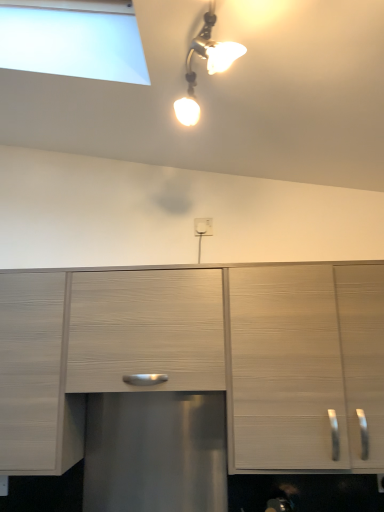
Question: Is white plastic electric outlet at center outside of light wood cabinet at right, the second cabinetry when ordered from left to right?

Choices:
 (A) yes
 (B) no

Answer: (A)

Question: Can you confirm if white plastic electric outlet at center is smaller than light wood cabinet at right, the second cabinetry when ordered from left to right?

Choices:
 (A) no
 (B) yes

Answer: (B)

Question: Is white plastic electric outlet at center positioned with its back to light wood cabinet at right, the first cabinetry when ordered from right to left?

Choices:
 (A) no
 (B) yes

Answer: (A)

Question: Does white plastic electric outlet at center have a lesser height compared to light wood cabinet at right, the second cabinetry when ordered from left to right?

Choices:
 (A) no
 (B) yes

Answer: (B)

Question: Is white plastic electric outlet at center to the left of light wood cabinet at right, the first cabinetry when ordered from right to left, from the viewer's perspective?

Choices:
 (A) no
 (B) yes

Answer: (B)

Question: Considering their positions, is light wood drawer at center located in front of or behind matte wood cabinet at left, which is counted as the second cabinetry, starting from the right?

Choices:
 (A) front
 (B) behind

Answer: (B)

Question: Does point (221, 388) appear closer or farther from the camera than point (36, 437)?

Choices:
 (A) farther
 (B) closer

Answer: (A)

Question: Based on their positions, is light wood drawer at center located to the left or right of matte wood cabinet at left, which is counted as the second cabinetry, starting from the right?

Choices:
 (A) right
 (B) left

Answer: (A)

Question: From the image's perspective, is light wood drawer at center positioned above or below matte wood cabinet at left, which is counted as the second cabinetry, starting from the right?

Choices:
 (A) above
 (B) below

Answer: (A)

Question: From a real-world perspective, is white plastic electric outlet at center physically located above or below light wood drawer at center?

Choices:
 (A) above
 (B) below

Answer: (A)

Question: Is white plastic electric outlet at center bigger or smaller than light wood drawer at center?

Choices:
 (A) big
 (B) small

Answer: (B)

Question: From their relative heights in the image, would you say white plastic electric outlet at center is taller or shorter than light wood drawer at center?

Choices:
 (A) tall
 (B) short

Answer: (B)

Question: From the image's perspective, relative to light wood drawer at center, is white plastic electric outlet at center above or below?

Choices:
 (A) below
 (B) above

Answer: (B)

Question: From a real-world perspective, is white plastic electric outlet at center positioned above or below light wood cabinet at right, the first cabinetry when ordered from right to left?

Choices:
 (A) above
 (B) below

Answer: (A)

Question: Is white plastic electric outlet at center situated inside light wood cabinet at right, the second cabinetry when ordered from left to right, or outside?

Choices:
 (A) outside
 (B) inside

Answer: (A)